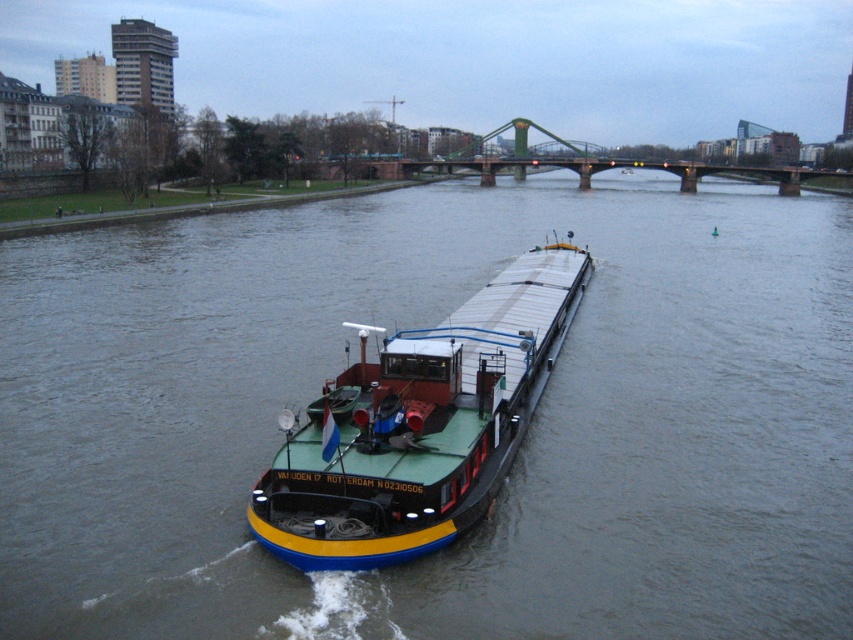
Question: Does smooth gray water at center appear over blue painted steel barge at center?

Choices:
 (A) no
 (B) yes

Answer: (B)

Question: Does smooth gray water at center have a smaller size compared to blue painted steel barge at center?

Choices:
 (A) yes
 (B) no

Answer: (B)

Question: Which of the following is the farthest from the observer?

Choices:
 (A) smooth gray water at center
 (B) blue painted steel barge at center

Answer: (B)

Question: Is smooth gray water at center wider than blue painted steel barge at center?

Choices:
 (A) yes
 (B) no

Answer: (A)